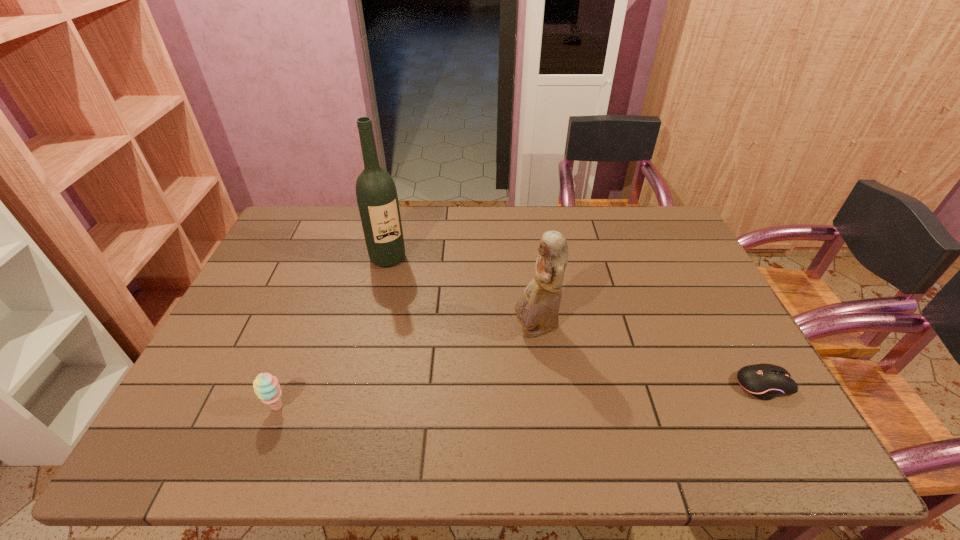
Identify the location of free region located 0.230m on the front-facing side of the figurine. (462, 396).

Find the location of a particular element. This screenshot has width=960, height=540. vacant region located 0.170m on the front-facing side of the figurine is located at coordinates (479, 380).

Locate an element on the screen. Image resolution: width=960 pixels, height=540 pixels. vacant region located 0.100m on the front-facing side of the figurine is located at coordinates (497, 363).

Locate an element on the screen. The height and width of the screenshot is (540, 960). free space located 0.170m on the labeled side of the wine bottle is located at coordinates (417, 302).

Where is `free space located 0.130m on the labeled side of the wine bottle`? This screenshot has height=540, width=960. free space located 0.130m on the labeled side of the wine bottle is located at coordinates (411, 294).

Where is `vacant space situated on the labeled side of the wine bottle`? The height and width of the screenshot is (540, 960). vacant space situated on the labeled side of the wine bottle is located at coordinates (420, 309).

You are a GUI agent. You are given a task and a screenshot of the screen. Output one action in this format:
    pyautogui.click(x=<x>, y=<y>)
    Task: Click on the sherbert that is at the near edge
    The height and width of the screenshot is (540, 960).
    Given the screenshot: What is the action you would take?
    pyautogui.click(x=266, y=387)

At what (x,y) coordinates should I click in order to perform the action: click on computer mouse that is at the near edge. Please return your answer as a coordinate pair (x, y). This screenshot has height=540, width=960. Looking at the image, I should click on (764, 381).

The height and width of the screenshot is (540, 960). I want to click on object that is at the right edge, so click(764, 381).

This screenshot has height=540, width=960. I want to click on object that is at the near right corner, so click(x=764, y=381).